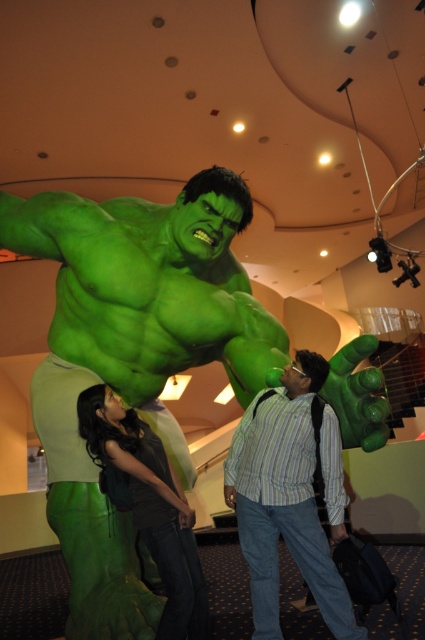
You are a security guard in the museum. You notice the striped cotton shirt at center and the matte green costume at lower left. Which one is closer to the entrance of the museum?

The striped cotton shirt at center is closer to the entrance of the museum because the matte green costume at lower left is behind it.

You are a visitor at the museum and want to take a photo of the green rubber statue at center and the striped cotton shirt at center together in the frame. Will both objects fit in the camera viewfinder if the viewfinder can only accommodate objects up to 1.5 meters wide?

The green rubber statue at center might be wider than striped cotton shirt at center, so it is uncertain if both will fit in the viewfinder. Check the actual width of the statue first.